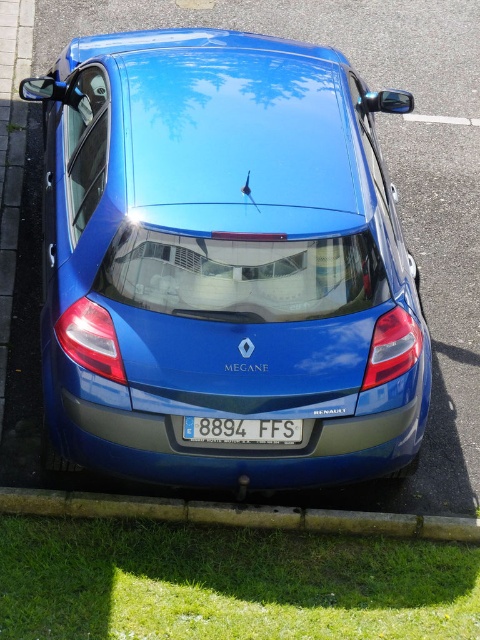
Question: Which object is farther from the camera taking this photo?

Choices:
 (A) green grass at lower center
 (B) glossy blue car at center
 (C) white plastic license plate at center

Answer: (A)

Question: Does green grass at lower center appear under white plastic license plate at center?

Choices:
 (A) yes
 (B) no

Answer: (A)

Question: Among these objects, which one is farthest from the camera?

Choices:
 (A) green grass at lower left
 (B) glossy blue car at center
 (C) green grass at lower center
 (D) white plastic license plate at center

Answer: (C)

Question: Which of these objects is positioned farthest from the white plastic license plate at center?

Choices:
 (A) green grass at lower center
 (B) green grass at lower left
 (C) glossy blue car at center

Answer: (C)

Question: Observing the image, what is the correct spatial positioning of glossy blue car at center in reference to green grass at lower center?

Choices:
 (A) right
 (B) left

Answer: (B)

Question: Can you confirm if glossy blue car at center is smaller than white plastic license plate at center?

Choices:
 (A) yes
 (B) no

Answer: (B)